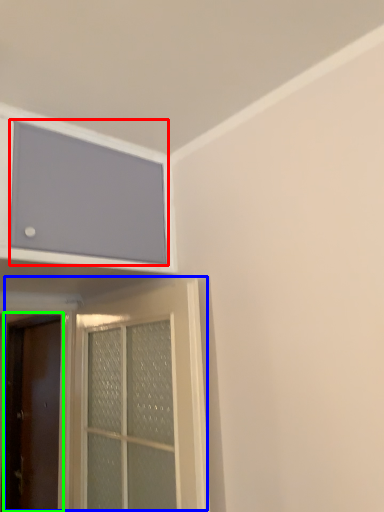
Question: Which object is positioned farthest from window screen (highlighted by a red box)? Select from door (highlighted by a blue box) and door (highlighted by a green box).

Choices:
 (A) door
 (B) door

Answer: (B)